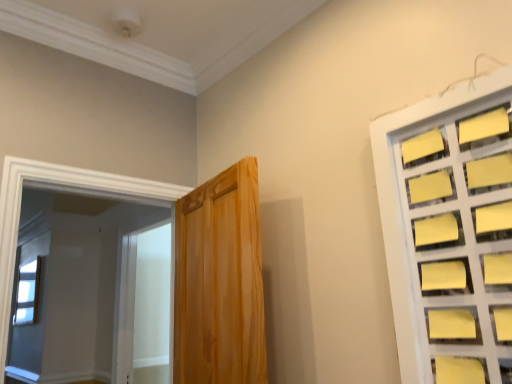
Question: Would you say white frosted glass screen door at left is to the left or to the right of clear glass window at upper left, which ranks as the 2th window in front-to-back order, in the picture?

Choices:
 (A) left
 (B) right

Answer: (B)

Question: Is white frosted glass screen door at left taller or shorter than clear glass window at upper left, which is counted as the second window, starting from the right?

Choices:
 (A) short
 (B) tall

Answer: (B)

Question: Which of these objects is positioned farthest from the yellow paper at right, the 1th window positioned from the front?

Choices:
 (A) wooden door at center
 (B) white frosted glass screen door at left
 (C) clear glass window at upper left, which appears as the 1th window when ordered from the bottom

Answer: (C)

Question: Estimate the real-world distances between objects in this image. Which object is farther from the wooden door at center?

Choices:
 (A) white frosted glass screen door at left
 (B) clear glass window at upper left, the first window when ordered from left to right
 (C) yellow paper at right, the 2th window in the bottom-to-top sequence

Answer: (B)